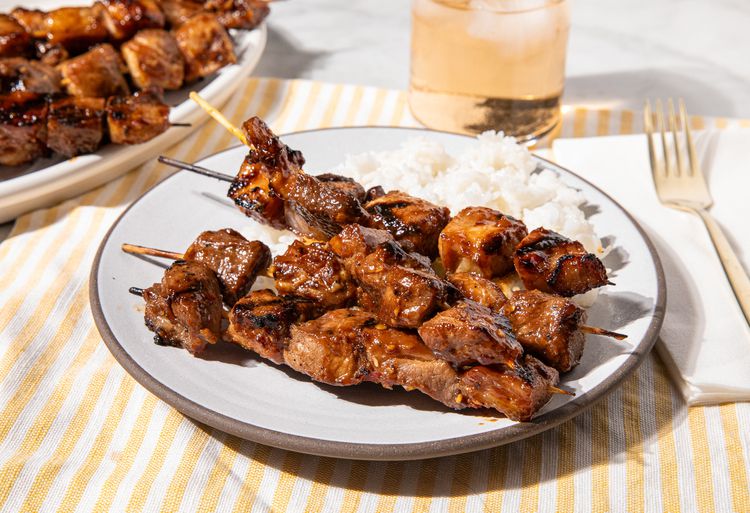
In order to click on space left of fork in this screenshot , I will do `click(667, 234)`.